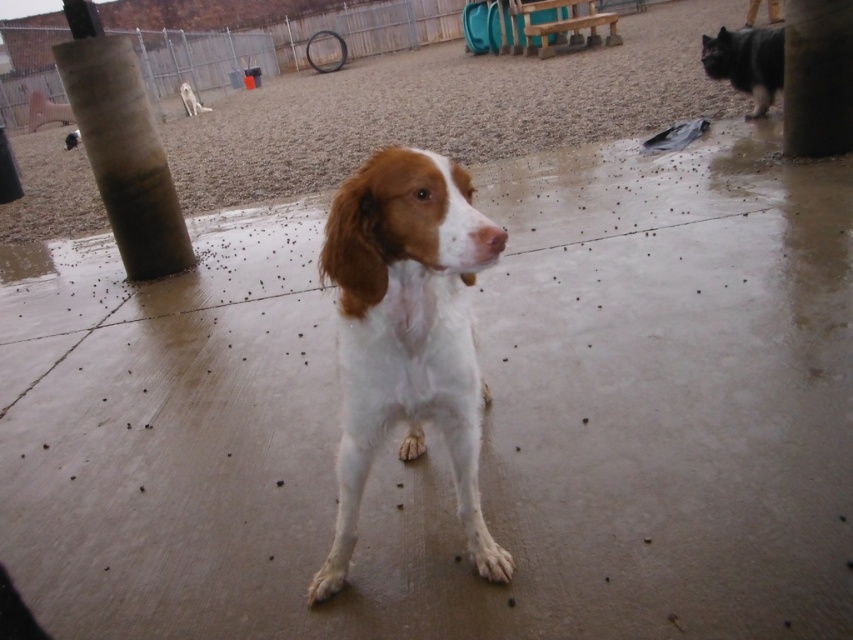
Question: Does white matte dog at center have a greater width compared to concrete textured pillar at center?

Choices:
 (A) no
 (B) yes

Answer: (B)

Question: Which object is closer to the camera taking this photo?

Choices:
 (A) concrete textured pillar at left
 (B) white matte dog at center

Answer: (B)

Question: Which point is closer to the camera taking this photo?

Choices:
 (A) (84, 72)
 (B) (773, 45)

Answer: (A)

Question: Which point is farther to the camera?

Choices:
 (A) concrete textured pillar at center
 (B) concrete textured pillar at left
 (C) dark brown fur dog at upper right
 (D) white matte dog at center

Answer: (C)

Question: Observing the image, what is the correct spatial positioning of concrete textured pillar at center in reference to dark brown fur dog at upper right?

Choices:
 (A) below
 (B) above

Answer: (A)

Question: Is concrete textured pillar at left thinner than white fur dog at upper left?

Choices:
 (A) yes
 (B) no

Answer: (A)